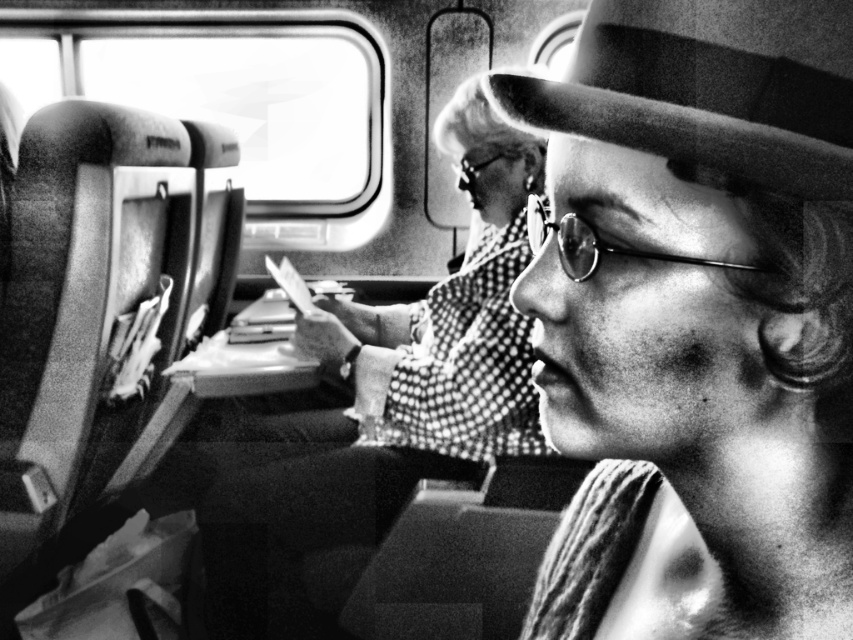
You are a photographer trying to capture a closeup of the striped fabric hat at center and metallic reflective goggles at upper center. Since you want to focus on the hat, which object should you adjust your camera lens to prioritize in terms of size in the frame?

The striped fabric hat at center has a greater height compared to metallic reflective goggles at upper center, so you should prioritize focusing on the striped fabric hat at center as it is larger in size.

You are a photographer trying to capture a closeup of the metallic reflective goggles at upper center and the striped fabric hat at center. Which object should you zoom in on first if you want to focus on the wider object?

The striped fabric hat at center is wider than the metallic reflective goggles at upper center, so you should focus on the striped fabric hat at center first.

From the picture: You are a passenger on a train and see a point marked at coordinates [695,320]. What object is this point located on?

The point at [695,320] is located on the striped fabric hat at center.